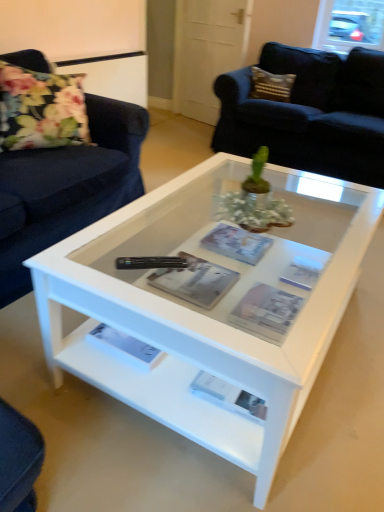
Describe the element at coordinates (151, 262) in the screenshot. I see `black plastic remote at center` at that location.

You are a GUI agent. You are given a task and a screenshot of the screen. Output one action in this format:
    pyautogui.click(x=<x>, y=<y>)
    Task: Click on the matte gray magazine at center, which appears as the 3th magazine when viewed from the back
    The image size is (384, 512).
    Given the screenshot: What is the action you would take?
    coord(266,312)

The height and width of the screenshot is (512, 384). In order to click on floral fabric pillow at left in this screenshot , I will do `click(41, 109)`.

The image size is (384, 512). Describe the element at coordinates (41, 109) in the screenshot. I see `floral fabric pillow at left` at that location.

Locate an element on the screen. The image size is (384, 512). black plastic remote at center is located at coordinates (151, 262).

Is the position of white glossy coffee table at center more distant than that of black plastic remote at center?

No, the depth of white glossy coffee table at center is less than that of black plastic remote at center.

From a real-world perspective, which is physically below, white glossy coffee table at center or black plastic remote at center?

From a 3D spatial view, white glossy coffee table at center is below.

Is white glossy coffee table at center turned away from black plastic remote at center?

white glossy coffee table at center does not have its back to black plastic remote at center.

Can you confirm if white glossy coffee table at center is smaller than black plastic remote at center?

Actually, white glossy coffee table at center might be larger than black plastic remote at center.

Is point (142, 260) closer to camera compared to point (282, 86)?

Yes, it is in front of point (282, 86).

Who is smaller, black plastic remote at center or suede-like brown pillow at upper right?

Smaller between the two is black plastic remote at center.

How different are the orientations of black plastic remote at center and suede-like brown pillow at upper right in degrees?

82.8 degrees separate the facing orientations of black plastic remote at center and suede-like brown pillow at upper right.

Looking at this image, which is correct: black plastic remote at center is inside suede-like brown pillow at upper right, or outside of it?

black plastic remote at center exists outside the volume of suede-like brown pillow at upper right.

How different are the orientations of floral fabric pillow at left and suede-like brown pillow at upper right in degrees?

The angular difference between floral fabric pillow at left and suede-like brown pillow at upper right is 11.9 degrees.

Does floral fabric pillow at left have a greater height compared to suede-like brown pillow at upper right?

Correct, floral fabric pillow at left is much taller as suede-like brown pillow at upper right.

Considering the positions of points (44, 144) and (288, 78), is point (44, 144) closer to camera compared to point (288, 78)?

Yes, point (44, 144) is in front of point (288, 78).

Does floral fabric pillow at left have a smaller size compared to suede-like brown pillow at upper right?

No.

From the image's perspective, which object appears higher, suede-like brown pillow at upper right or matte gray magazine at center, which appears as the first magazine when viewed from the back?

suede-like brown pillow at upper right is shown above in the image.

Consider the image. Considering the sizes of objects suede-like brown pillow at upper right and matte gray magazine at center, which appears as the third magazine when viewed from the front, in the image provided, who is bigger, suede-like brown pillow at upper right or matte gray magazine at center, which appears as the third magazine when viewed from the front,?

With larger size is suede-like brown pillow at upper right.

Considering the sizes of objects suede-like brown pillow at upper right and matte gray magazine at center, which appears as the first magazine when viewed from the back, in the image provided, who is wider, suede-like brown pillow at upper right or matte gray magazine at center, which appears as the first magazine when viewed from the back,?

Wider between the two is matte gray magazine at center, which appears as the first magazine when viewed from the back.

Based on the photo, is suede-like brown pillow at upper right oriented towards matte gray magazine at center, which appears as the first magazine when viewed from the back?

No, suede-like brown pillow at upper right is not aimed at matte gray magazine at center, which appears as the first magazine when viewed from the back.

Based on the photo, from a real-world perspective, is white glossy coffee table at center positioned above or below matte gray magazine at center, which appears as the first magazine when viewed from the back?

In terms of real-world spatial position, white glossy coffee table at center is below matte gray magazine at center, which appears as the first magazine when viewed from the back.

From the image's perspective, which is above, white glossy coffee table at center or matte gray magazine at center, which appears as the third magazine when viewed from the front?

From the image's view, white glossy coffee table at center is above.

Can we say white glossy coffee table at center lies outside matte gray magazine at center, which appears as the first magazine when viewed from the back?

Yes.

Considering the positions of objects matte gray magazine at center, which appears as the 3th magazine when viewed from the back, and matte paper magazine at center, the 2th magazine viewed from the front, in the image provided, who is more to the right, matte gray magazine at center, which appears as the 3th magazine when viewed from the back, or matte paper magazine at center, the 2th magazine viewed from the front,?

From the viewer's perspective, matte gray magazine at center, which appears as the 3th magazine when viewed from the back, appears more on the right side.

At what (x,y) coordinates should I click in order to perform the action: click on magazine that is the 2nd one when counting leftward from the matte gray magazine at center, marked as the first magazine in a front-to-back arrangement. Please return your answer as a coordinate pair (x, y). Looking at the image, I should click on (195, 281).

From the image's perspective, is matte gray magazine at center, marked as the first magazine in a front-to-back arrangement, beneath matte paper magazine at center, which appears as the 2th magazine when viewed from the back?

Yes, from the image's perspective, matte gray magazine at center, marked as the first magazine in a front-to-back arrangement, is below matte paper magazine at center, which appears as the 2th magazine when viewed from the back.

Looking at this image, is white glossy coffee table at center not inside floral fabric pillow at left?

Yes, white glossy coffee table at center is located beyond the bounds of floral fabric pillow at left.

How different are the orientations of white glossy coffee table at center and floral fabric pillow at left in degrees?

The angle between the facing direction of white glossy coffee table at center and the facing direction of floral fabric pillow at left is 148 degrees.

Which is behind, point (358, 201) or point (63, 85)?

The point (63, 85) is farther from the camera.

Looking at the image, does white glossy coffee table at center seem bigger or smaller compared to floral fabric pillow at left?

white glossy coffee table at center is bigger than floral fabric pillow at left.

Locate an element on the screen. The width and height of the screenshot is (384, 512). remote that is below the white glossy coffee table at center (from the image's perspective) is located at coordinates (151, 262).

Find the location of a particular element. Image resolution: width=384 pixels, height=512 pixels. remote beneath the suede-like brown pillow at upper right (from a real-world perspective) is located at coordinates (151, 262).

Looking at the image, which one is located further to matte gray magazine at center, which appears as the first magazine when viewed from the back, floral fabric pillow at left or black plastic remote at center?

The object further to matte gray magazine at center, which appears as the first magazine when viewed from the back, is floral fabric pillow at left.

From the image, which object appears to be farther from matte gray magazine at center, which appears as the third magazine when viewed from the front, white glossy coffee table at center or matte gray magazine at center, marked as the first magazine in a front-to-back arrangement?

Based on the image, white glossy coffee table at center appears to be further to matte gray magazine at center, which appears as the third magazine when viewed from the front.

Considering their positions, is black plastic remote at center positioned further to white glossy coffee table at center than floral fabric pillow at left?

Among the two, floral fabric pillow at left is located further to white glossy coffee table at center.

Based on the photo, based on their spatial positions, is matte gray magazine at center, which appears as the 3th magazine when viewed from the back, or white glossy coffee table at center closer to matte gray magazine at center, which appears as the third magazine when viewed from the front?

matte gray magazine at center, which appears as the 3th magazine when viewed from the back, lies closer to matte gray magazine at center, which appears as the third magazine when viewed from the front, than the other object.

Based on their spatial positions, is matte gray magazine at center, which appears as the third magazine when viewed from the front, or floral fabric pillow at left closer to white glossy coffee table at center?

The object closer to white glossy coffee table at center is matte gray magazine at center, which appears as the third magazine when viewed from the front.

Which object lies further to the anchor point matte paper magazine at center, the 2th magazine viewed from the front, white glossy coffee table at center or suede-like brown pillow at upper right?

Among the two, suede-like brown pillow at upper right is located further to matte paper magazine at center, the 2th magazine viewed from the front.

Consider the image. Considering their positions, is black plastic remote at center positioned closer to suede-like brown pillow at upper right than matte gray magazine at center, marked as the first magazine in a front-to-back arrangement?

Among the two, matte gray magazine at center, marked as the first magazine in a front-to-back arrangement, is located nearer to suede-like brown pillow at upper right.

When comparing their distances from suede-like brown pillow at upper right, does matte gray magazine at center, which appears as the 3th magazine when viewed from the back, or matte paper magazine at center, the 2th magazine viewed from the front, seem closer?

matte paper magazine at center, the 2th magazine viewed from the front, lies closer to suede-like brown pillow at upper right than the other object.

The width and height of the screenshot is (384, 512). What are the coordinates of `remote positioned between white glossy coffee table at center and matte gray magazine at center, which appears as the 3th magazine when viewed from the back, from near to far` in the screenshot? It's located at (151, 262).

Locate an element on the screen. The image size is (384, 512). flower positioned between black plastic remote at center and suede-like brown pillow at upper right from near to far is located at coordinates (41, 109).

The image size is (384, 512). What are the coordinates of `magazine between floral fabric pillow at left and matte gray magazine at center, which appears as the first magazine when viewed from the back, from left to right` in the screenshot? It's located at (195, 281).

Where is `remote between white glossy coffee table at center and matte paper magazine at center, the 2th magazine viewed from the front, from front to back`? remote between white glossy coffee table at center and matte paper magazine at center, the 2th magazine viewed from the front, from front to back is located at coordinates (151, 262).